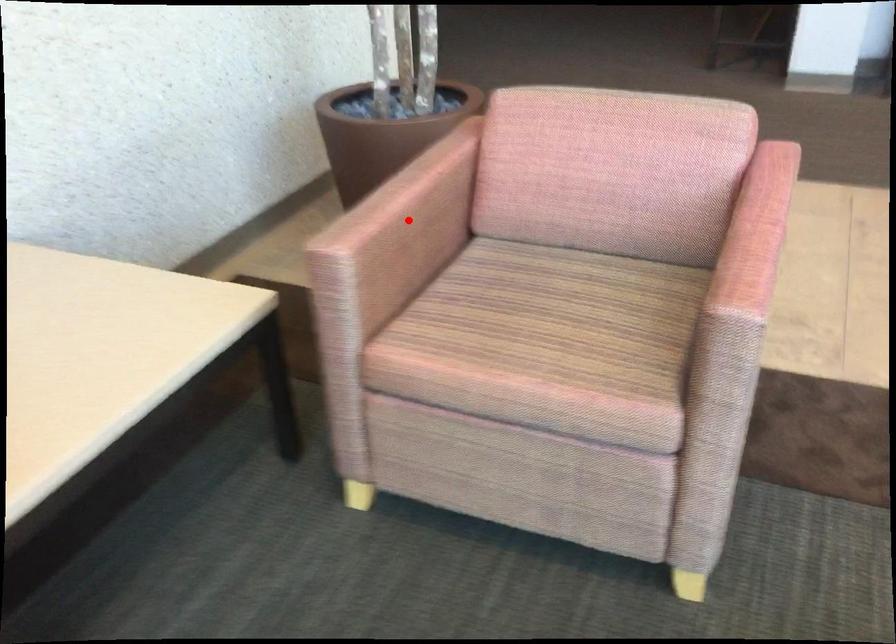
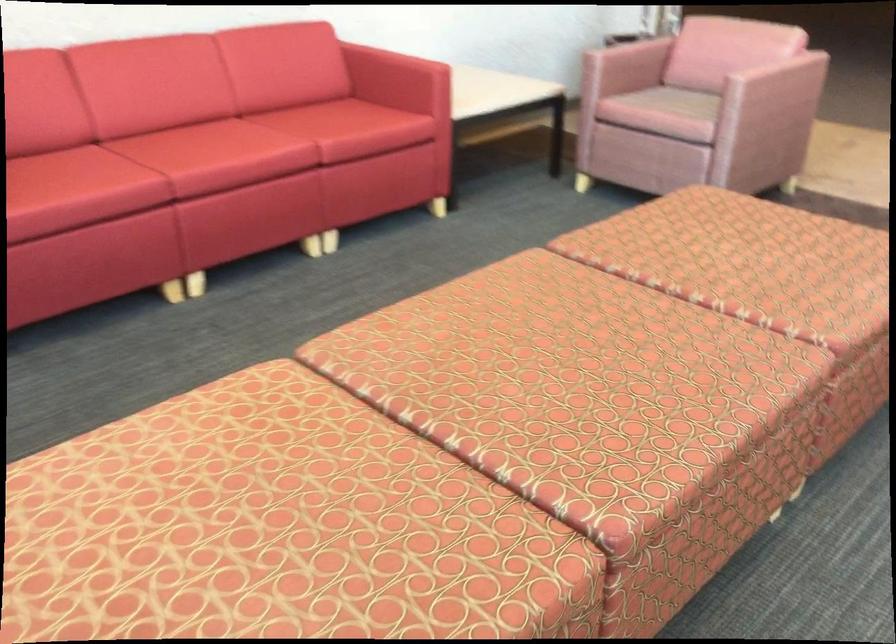
Question: I am providing you with two images of the same scene from different viewpoints. In image1, a red point is highlighted. Considering the same 3D point in image2, which of the following is correct?

Choices:
 (A) It is closer
 (B) It is farther

Answer: (B)